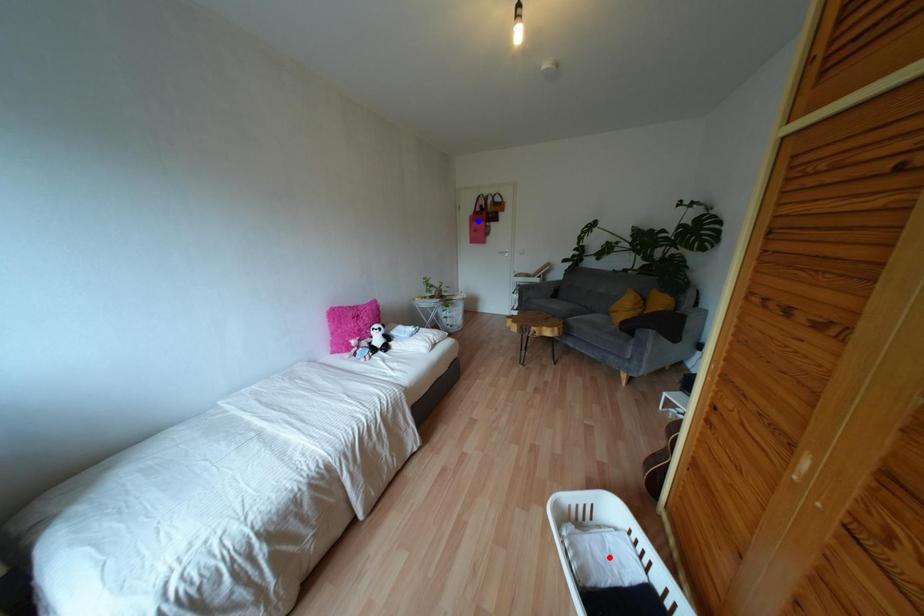
Question: In the image, two points are highlighted. Which point is nearer to the camera? Reply with the corresponding letter.

Choices:
 (A) blue point
 (B) red point

Answer: (B)